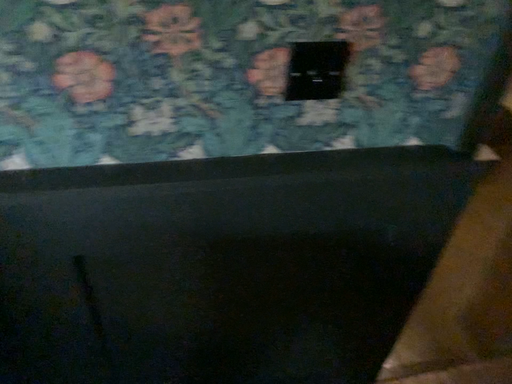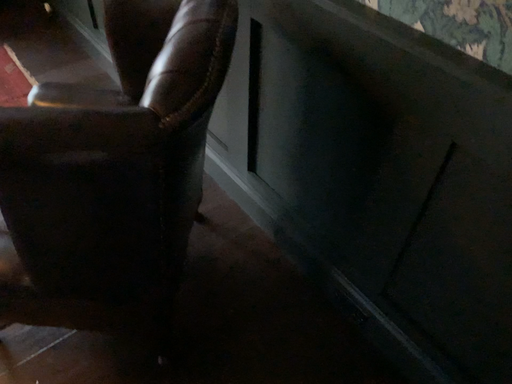
Question: Which way did the camera rotate in the video?

Choices:
 (A) rotated left
 (B) rotated right

Answer: (A)